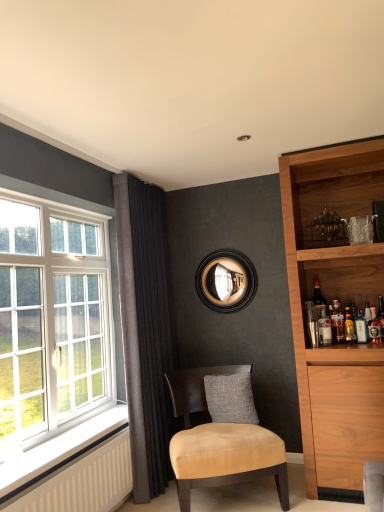
Question: From the image's perspective, is white textured radiator at lower left over clear glass bottle at upper right, acting as the fourth beverage starting from the right?

Choices:
 (A) no
 (B) yes

Answer: (A)

Question: Is white textured radiator at lower left thinner than clear glass bottle at upper right, acting as the fourth beverage starting from the right?

Choices:
 (A) yes
 (B) no

Answer: (B)

Question: From a real-world perspective, does white textured radiator at lower left sit lower than clear glass bottle at upper right, placed as the 1th beverage when sorted from left to right?

Choices:
 (A) yes
 (B) no

Answer: (A)

Question: Considering the relative sizes of white textured radiator at lower left and clear glass bottle at upper right, placed as the 1th beverage when sorted from left to right, in the image provided, is white textured radiator at lower left smaller than clear glass bottle at upper right, placed as the 1th beverage when sorted from left to right,?

Choices:
 (A) yes
 (B) no

Answer: (B)

Question: Does white textured radiator at lower left have a greater width compared to clear glass bottle at upper right, placed as the 1th beverage when sorted from left to right?

Choices:
 (A) no
 (B) yes

Answer: (B)

Question: From a real-world perspective, is shiny dark glass bottle at upper right, which is the second bottle from right to left, positioned above or below translucent glass bottle at upper right, marked as the 2th beverage in a left-to-right arrangement?

Choices:
 (A) below
 (B) above

Answer: (B)

Question: Visually, is shiny dark glass bottle at upper right, marked as the 2th bottle in a front-to-back arrangement, positioned to the left or to the right of translucent glass bottle at upper right, marked as the 2th beverage in a left-to-right arrangement?

Choices:
 (A) left
 (B) right

Answer: (A)

Question: Is shiny dark glass bottle at upper right, the first bottle when ordered from left to right, taller or shorter than translucent glass bottle at upper right, marked as the 2th beverage in a left-to-right arrangement?

Choices:
 (A) short
 (B) tall

Answer: (A)

Question: Relative to translucent glass bottle at upper right, which appears as the 3th beverage when viewed from the right, is shiny dark glass bottle at upper right, the first bottle when ordered from left to right, in front or behind?

Choices:
 (A) behind
 (B) front

Answer: (A)

Question: Is white glass window at left spatially inside dark grey velvet curtain at left, or outside of it?

Choices:
 (A) outside
 (B) inside

Answer: (A)

Question: Considering the positions of white glass window at left and dark grey velvet curtain at left in the image, is white glass window at left bigger or smaller than dark grey velvet curtain at left?

Choices:
 (A) big
 (B) small

Answer: (A)

Question: From their relative heights in the image, would you say white glass window at left is taller or shorter than dark grey velvet curtain at left?

Choices:
 (A) tall
 (B) short

Answer: (B)

Question: In terms of width, does white glass window at left look wider or thinner when compared to dark grey velvet curtain at left?

Choices:
 (A) wide
 (B) thin

Answer: (A)

Question: From the image's perspective, is translucent glass bottle at right, placed as the first beverage when sorted from right to left, above or below suede beige chair at center?

Choices:
 (A) below
 (B) above

Answer: (B)

Question: In terms of height, does translucent glass bottle at right, the fourth beverage positioned from the left, look taller or shorter compared to suede beige chair at center?

Choices:
 (A) tall
 (B) short

Answer: (B)